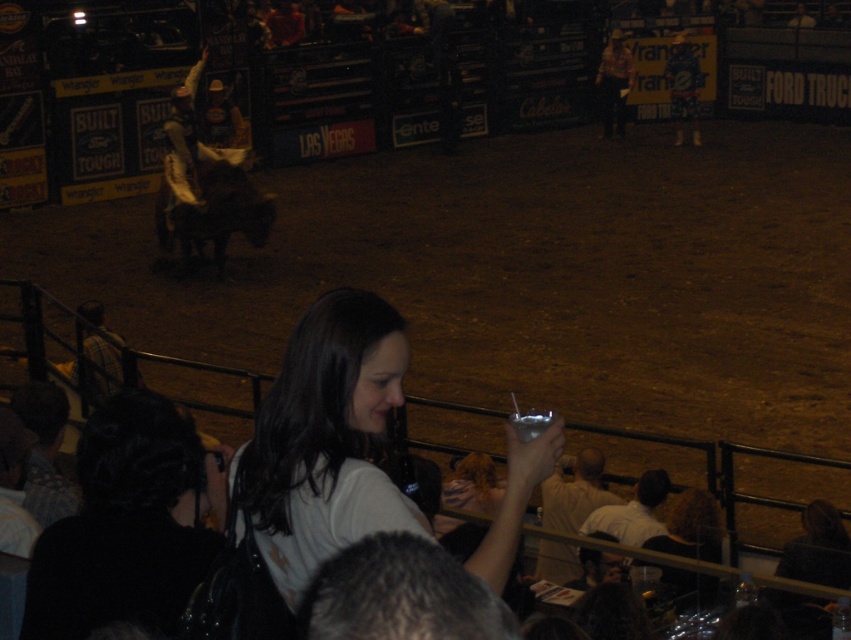
Who is positioned more to the right, white matte shirt at center or light beige shirt at lower center?

light beige shirt at lower center

Who is more forward, (263,531) or (555,490)?

Point (263,531) is in front.

Is point (267, 540) more distant than point (552, 476)?

No, (267, 540) is in front of (552, 476).

Locate an element on the screen. The width and height of the screenshot is (851, 640). white matte shirt at center is located at coordinates (324, 442).

Does white matte shirt at center have a lesser width compared to dark brown leather horse at center?

Yes.

Does white matte shirt at center have a smaller size compared to dark brown leather horse at center?

Yes, white matte shirt at center is smaller than dark brown leather horse at center.

Between point (335, 460) and point (244, 202), which one is positioned behind?

Positioned behind is point (244, 202).

The width and height of the screenshot is (851, 640). Find the location of `white matte shirt at center`. white matte shirt at center is located at coordinates (324, 442).

Does point (252, 513) lie behind point (43, 557)?

No, (252, 513) is closer to viewer.

This screenshot has height=640, width=851. What are the coordinates of `white matte shirt at center` in the screenshot? It's located at (324, 442).

This screenshot has height=640, width=851. Find the location of `white matte shirt at center`. white matte shirt at center is located at coordinates (324, 442).